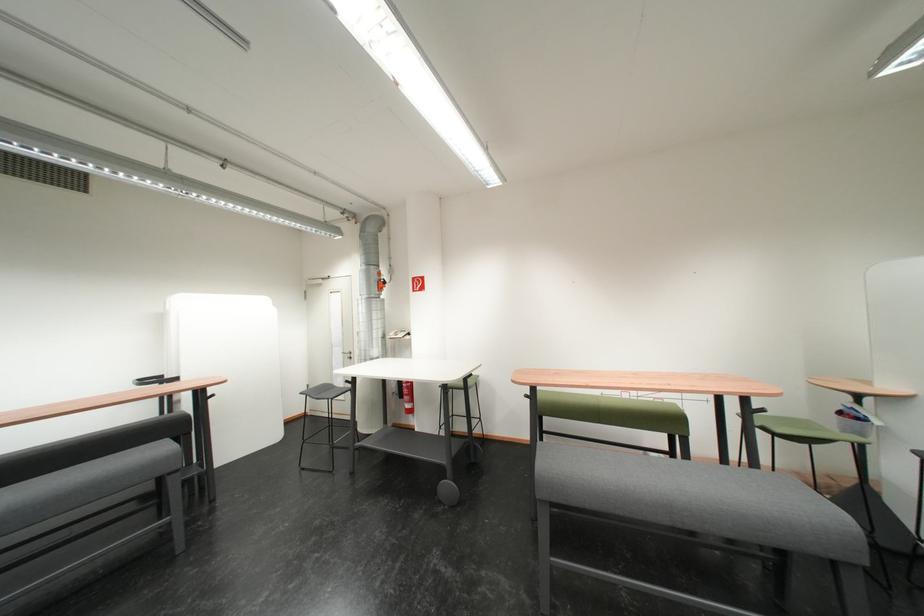
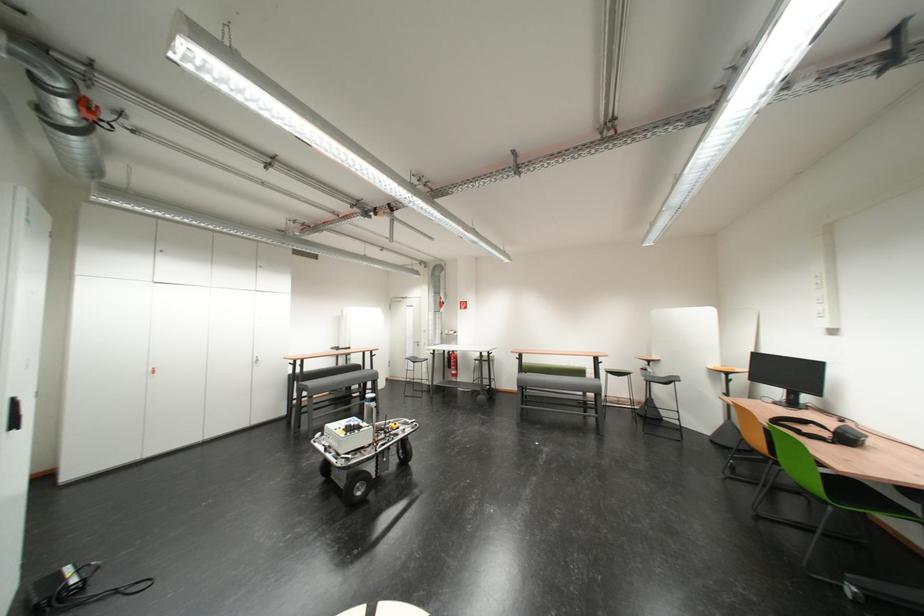
Question: Which direction would the cameraman need to move to produce the second image? Reply with the corresponding letter.

Choices:
 (A) Left
 (B) Right
 (C) Forward
 (D) Backward

Answer: (D)